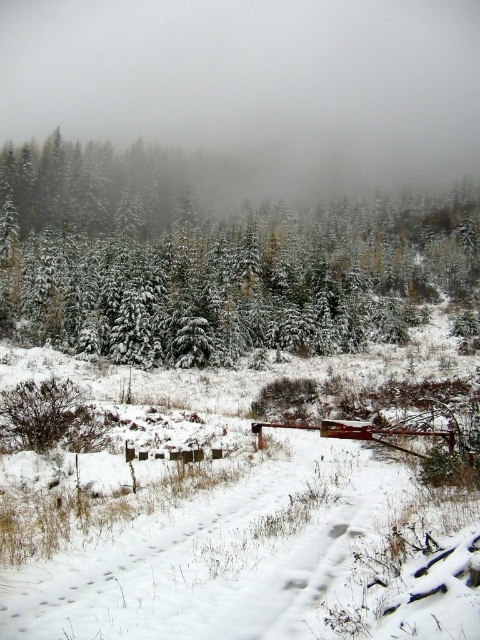
Question: Which point is closer to the camera taking this photo?

Choices:
 (A) (104, 224)
 (B) (420, 145)

Answer: (A)

Question: Is white foggy cloud at upper center to the left of snow-covered evergreen trees at upper center from the viewer's perspective?

Choices:
 (A) yes
 (B) no

Answer: (B)

Question: Is white foggy cloud at upper center above snow-covered evergreen trees at upper center?

Choices:
 (A) yes
 (B) no

Answer: (A)

Question: Is white foggy cloud at upper center further to camera compared to snow-covered evergreen trees at upper center?

Choices:
 (A) no
 (B) yes

Answer: (B)

Question: Which of the following is the closest to the observer?

Choices:
 (A) (116, 4)
 (B) (360, 250)

Answer: (B)